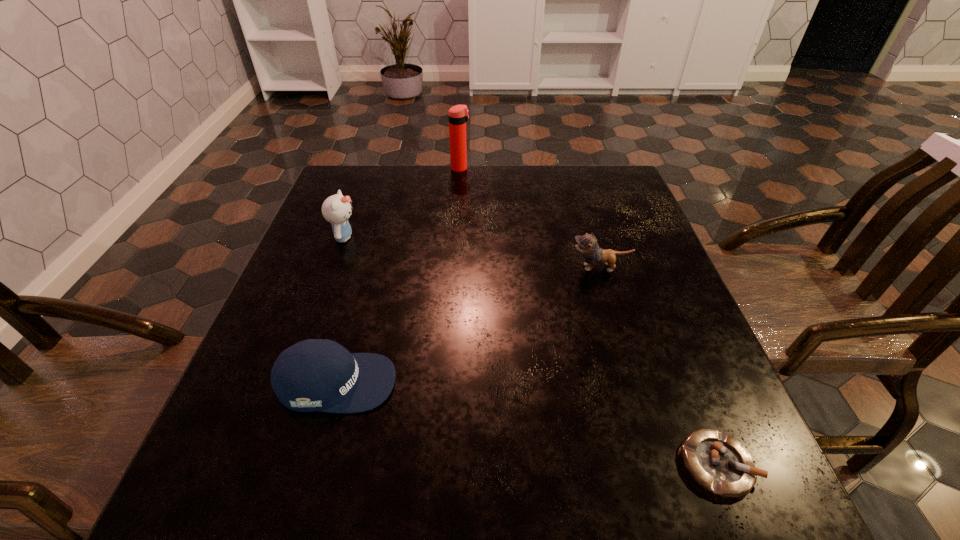
The height and width of the screenshot is (540, 960). What are the coordinates of `vacant space situated 0.110m on the front of the thermos bottle` in the screenshot? It's located at (459, 192).

Find the location of `vacant region located on the front-facing side of the farther kitten`. vacant region located on the front-facing side of the farther kitten is located at coordinates (492, 237).

I want to click on vacant region located 0.360m on the front-facing side of the nearer kitten, so click(x=413, y=268).

Identify the location of vacant space located on the front-facing side of the nearer kitten. (478, 268).

The width and height of the screenshot is (960, 540). I want to click on vacant area located on the front-facing side of the nearer kitten, so click(444, 268).

Locate an element on the screen. vacant position located 0.260m on the front-facing side of the second shortest object is located at coordinates (541, 382).

Where is `vacant area located 0.200m on the left of the nearest object`? Image resolution: width=960 pixels, height=540 pixels. vacant area located 0.200m on the left of the nearest object is located at coordinates 552,464.

Identify the location of object located in the far edge section of the desktop. (458, 115).

Find the location of a particular element. This screenshot has width=960, height=540. object that is at the near edge is located at coordinates (718, 463).

Find the location of a particular element. The height and width of the screenshot is (540, 960). kitten that is at the left edge is located at coordinates (336, 209).